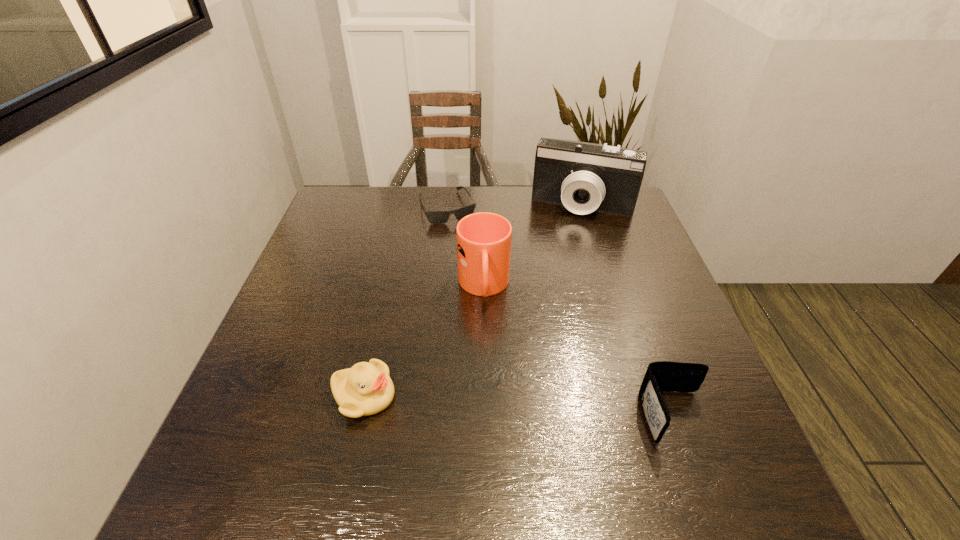
What are the coordinates of `vacant area that lies between the sunglasses and the camcorder` in the screenshot? It's located at (516, 207).

The height and width of the screenshot is (540, 960). What are the coordinates of `free point between the duckling and the wallet` in the screenshot? It's located at 519,406.

The height and width of the screenshot is (540, 960). Identify the location of empty space that is in between the duckling and the second tallest object. (424, 341).

This screenshot has height=540, width=960. I want to click on vacant point located between the shortest object and the wallet, so click(x=561, y=312).

In order to click on vacant area that lies between the camcorder and the shortest object in this screenshot , I will do `click(516, 207)`.

Identify the location of unoccupied area between the wallet and the duckling. (519, 406).

This screenshot has height=540, width=960. What are the coordinates of `vacant space in between the tallest object and the fourth shortest object` in the screenshot? It's located at (534, 246).

Where is `empty space between the mug and the camcorder`? The width and height of the screenshot is (960, 540). empty space between the mug and the camcorder is located at coordinates (534, 246).

The image size is (960, 540). In order to click on free space between the sunglasses and the wallet in this screenshot , I will do `click(561, 312)`.

The width and height of the screenshot is (960, 540). In order to click on free space between the shortest object and the wallet in this screenshot , I will do (x=561, y=312).